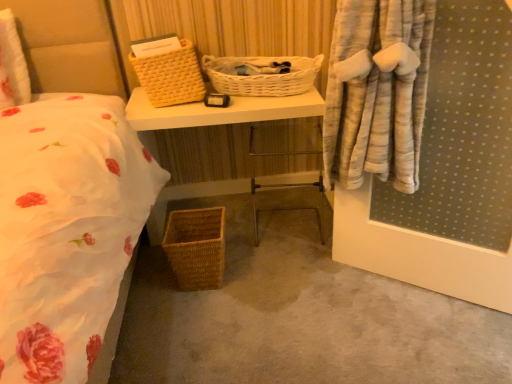
Question: From a real-world perspective, is metallic silver chair at center physically located above or below woven brown picnic basket at lower center, the third picnic basket viewed from the top?

Choices:
 (A) below
 (B) above

Answer: (B)

Question: In terms of height, does metallic silver chair at center look taller or shorter compared to woven brown picnic basket at lower center, the third picnic basket viewed from the top?

Choices:
 (A) tall
 (B) short

Answer: (A)

Question: Which object is the farthest from the yellow woven picnic basket at upper center, the 3th picnic basket positioned from the bottom?

Choices:
 (A) matte wicker basket at center
 (B) woven brown picnic basket at lower center, the 1th picnic basket from the bottom
 (C) metallic silver chair at center
 (D) woven basket at lower left
 (E) white wicker picnic basket at center, the second picnic basket when ordered from top to bottom

Answer: (D)

Question: Which of these objects is positioned farthest from the yellow woven picnic basket at upper center, the 1th picnic basket positioned from the top?

Choices:
 (A) woven brown picnic basket at lower center, the third picnic basket viewed from the top
 (B) matte wicker basket at center
 (C) metallic silver chair at center
 (D) woven basket at lower left
 (E) white wicker picnic basket at center, marked as the second picnic basket in a bottom-to-top arrangement

Answer: (D)